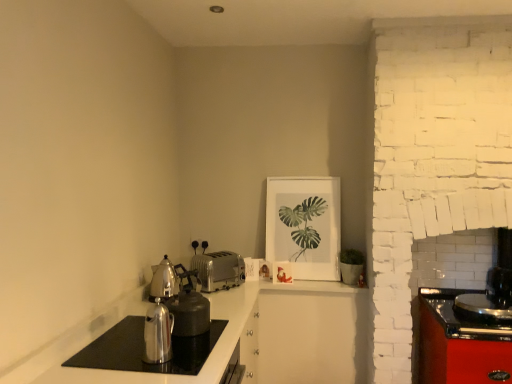
Image resolution: width=512 pixels, height=384 pixels. Identify the location of blank space situated above matte white picture frame at upper center (from a real-world perspective). (304, 176).